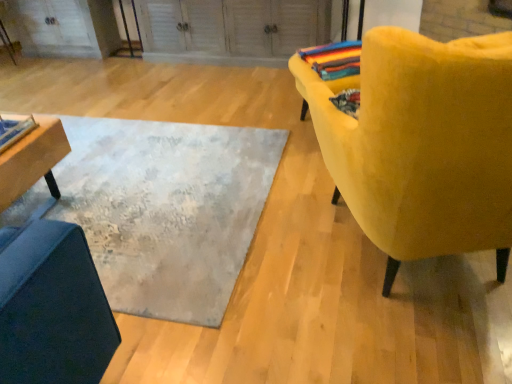
Find the location of a particular element. The height and width of the screenshot is (384, 512). free space that is to the left of velvet yellow chair at right is located at coordinates (263, 296).